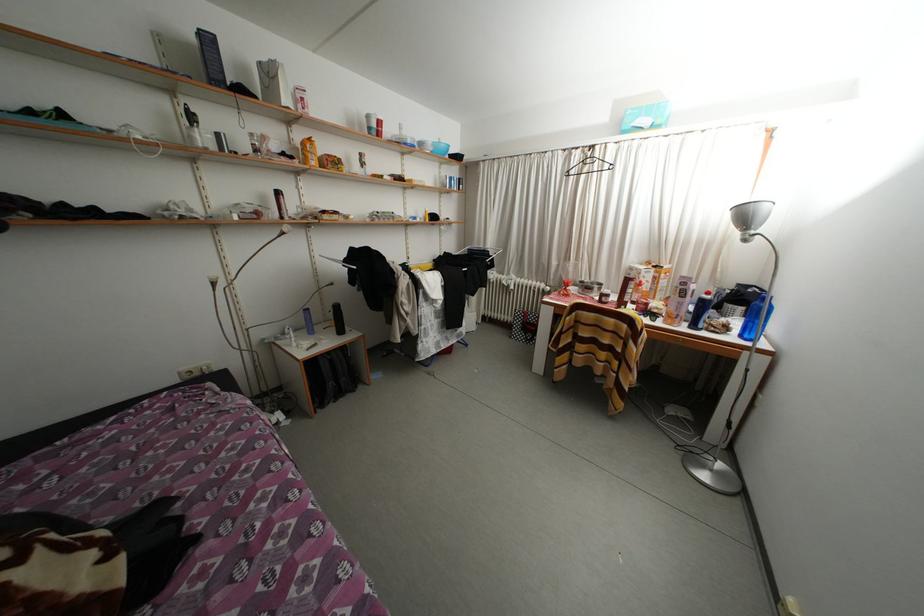
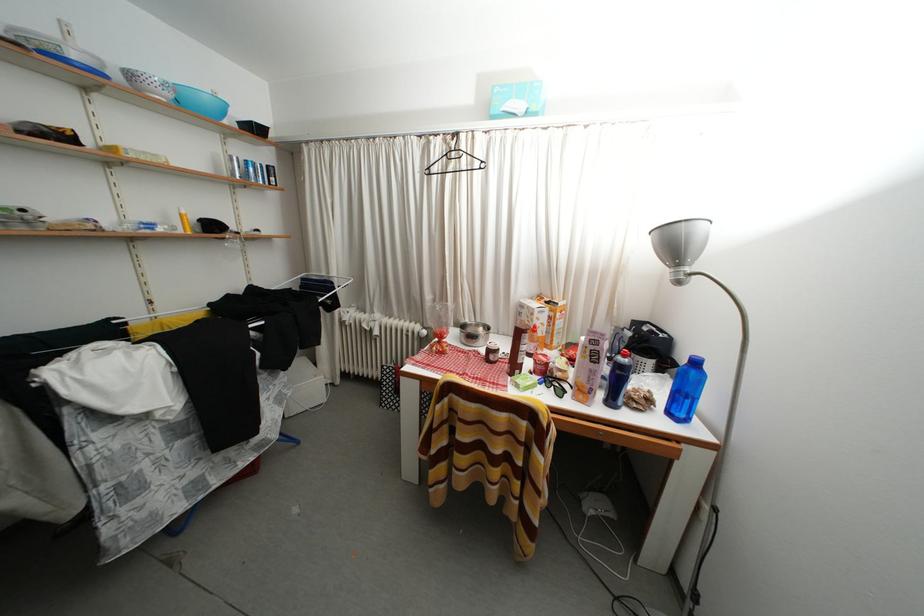
Locate, in the second image, the point that corresponds to [417,147] in the first image.

(81, 61)